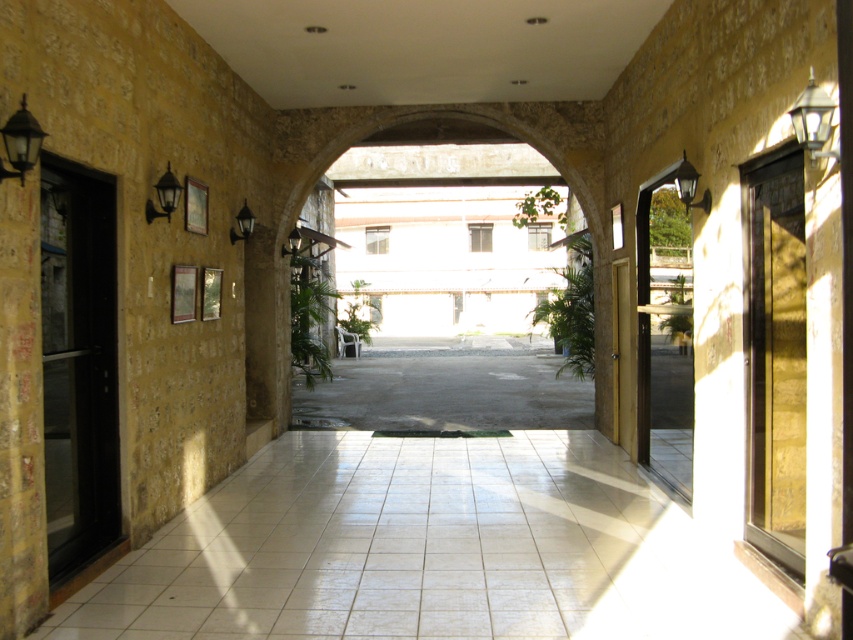
Describe the element at coordinates (503, 134) in the screenshot. I see `stone archway at center` at that location.

Who is more distant from viewer, (627, 278) or (294, 244)?

Point (294, 244)

You are a GUI agent. You are given a task and a screenshot of the screen. Output one action in this format:
    pyautogui.click(x=<x>, y=<y>)
    Task: Click on the stone archway at center
    
    Given the screenshot: What is the action you would take?
    pyautogui.click(x=503, y=134)

This screenshot has width=853, height=640. Describe the element at coordinates (813, 120) in the screenshot. I see `white glossy streetlamp at upper right` at that location.

Consider the image. Is white glossy streetlamp at upper right below matte black wall lamp at upper left?

No.

Between point (814, 84) and point (163, 182), which one is positioned in front?

Point (814, 84) is more forward.

You are a GUI agent. You are given a task and a screenshot of the screen. Output one action in this format:
    pyautogui.click(x=<x>, y=<y>)
    Task: Click on the white glossy streetlamp at upper right
    The height and width of the screenshot is (640, 853).
    Given the screenshot: What is the action you would take?
    pyautogui.click(x=813, y=120)

Is white glossy streetlamp at upper right to the left of black matte lamp at left from the viewer's perspective?

No, white glossy streetlamp at upper right is not to the left of black matte lamp at left.

Does white glossy streetlamp at upper right have a lesser width compared to black matte lamp at left?

Correct, white glossy streetlamp at upper right's width is less than black matte lamp at left's.

Which is in front, point (827, 132) or point (44, 132)?

Positioned in front is point (827, 132).

The width and height of the screenshot is (853, 640). Identify the location of white glossy streetlamp at upper right. (813, 120).